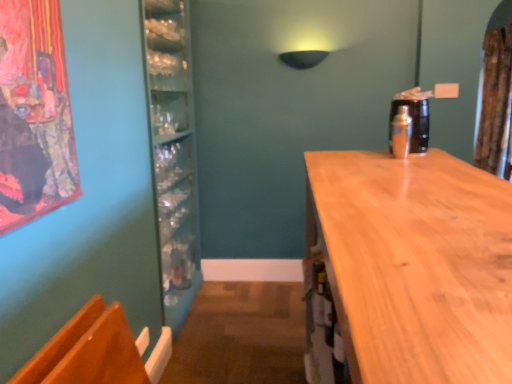
Question: Would you say brown textured curtain at upper right is inside or outside wooden armchair at lower left?

Choices:
 (A) inside
 (B) outside

Answer: (B)

Question: Is point (482, 122) positioned closer to the camera than point (57, 350)?

Choices:
 (A) farther
 (B) closer

Answer: (A)

Question: Which object is positioned closest to the light brown wood countertop at right?

Choices:
 (A) shiny metallic shaker at right
 (B) wooden armchair at lower left
 (C) brown textured curtain at upper right

Answer: (A)

Question: Which of these objects is positioned farthest from the light brown wood countertop at right?

Choices:
 (A) brown textured curtain at upper right
 (B) shiny metallic shaker at right
 (C) wooden armchair at lower left

Answer: (A)